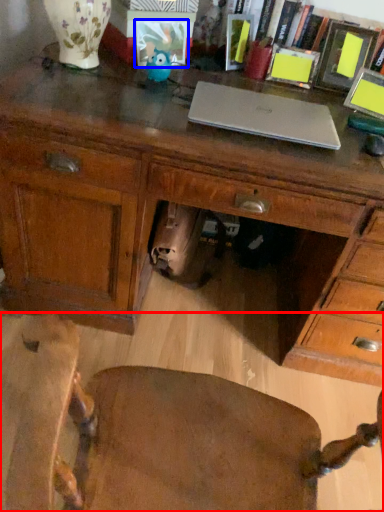
Question: Which object appears farthest to the camera in this image, chair (highlighted by a red box) or picture frame (highlighted by a blue box)?

Choices:
 (A) chair
 (B) picture frame

Answer: (B)